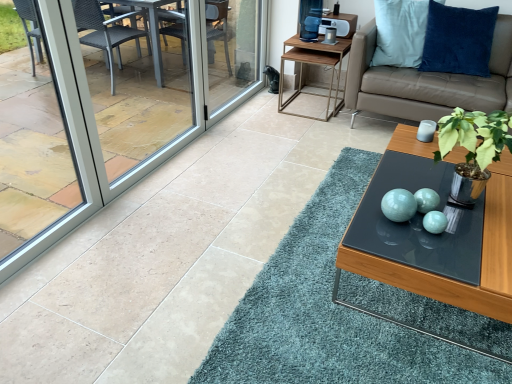
Question: Are transparent glass window at left and beige leather couch at upper right beside each other?

Choices:
 (A) yes
 (B) no

Answer: (B)

Question: Would you consider transparent glass window at left to be distant from beige leather couch at upper right?

Choices:
 (A) no
 (B) yes

Answer: (B)

Question: Is transparent glass window at left facing towards beige leather couch at upper right?

Choices:
 (A) yes
 (B) no

Answer: (B)

Question: From a real-world perspective, is transparent glass window at left beneath beige leather couch at upper right?

Choices:
 (A) yes
 (B) no

Answer: (B)

Question: Does transparent glass window at left appear on the right side of beige leather couch at upper right?

Choices:
 (A) yes
 (B) no

Answer: (B)

Question: Can you confirm if transparent glass window at left is taller than beige leather couch at upper right?

Choices:
 (A) yes
 (B) no

Answer: (A)

Question: Is green leafy plant in metallic pot at center-right positioned far away from matte glass coffee table at center?

Choices:
 (A) no
 (B) yes

Answer: (A)

Question: Is green leafy plant in metallic pot at center-right next to matte glass coffee table at center?

Choices:
 (A) no
 (B) yes

Answer: (A)

Question: Is green leafy plant in metallic pot at center-right positioned with its back to matte glass coffee table at center?

Choices:
 (A) yes
 (B) no

Answer: (B)

Question: Is green leafy plant in metallic pot at center-right behind matte glass coffee table at center?

Choices:
 (A) no
 (B) yes

Answer: (B)

Question: From a real-world perspective, does green leafy plant in metallic pot at center-right sit lower than matte glass coffee table at center?

Choices:
 (A) yes
 (B) no

Answer: (B)

Question: Does green leafy plant in metallic pot at center-right appear on the right side of matte glass coffee table at center?

Choices:
 (A) yes
 (B) no

Answer: (B)

Question: Is wooden side table at upper right far away from matte glass coffee table at center?

Choices:
 (A) yes
 (B) no

Answer: (A)